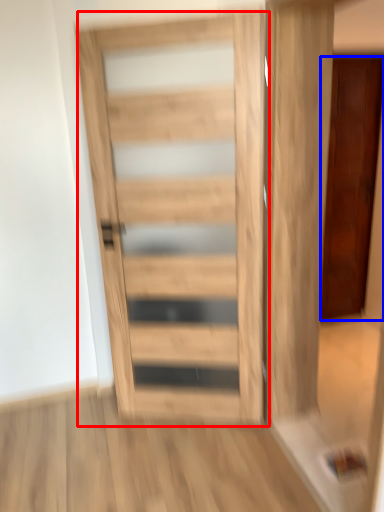
Question: Among these objects, which one is nearest to the camera, door (highlighted by a red box) or door (highlighted by a blue box)?

Choices:
 (A) door
 (B) door

Answer: (A)